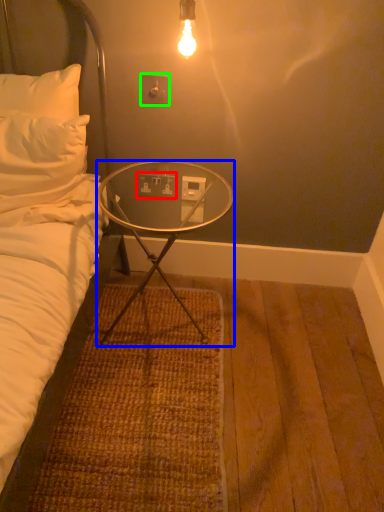
Question: Considering the real-world distances, which object is farthest from electric outlet (highlighted by a red box)? desk (highlighted by a blue box) or electric outlet (highlighted by a green box)?

Choices:
 (A) desk
 (B) electric outlet

Answer: (B)